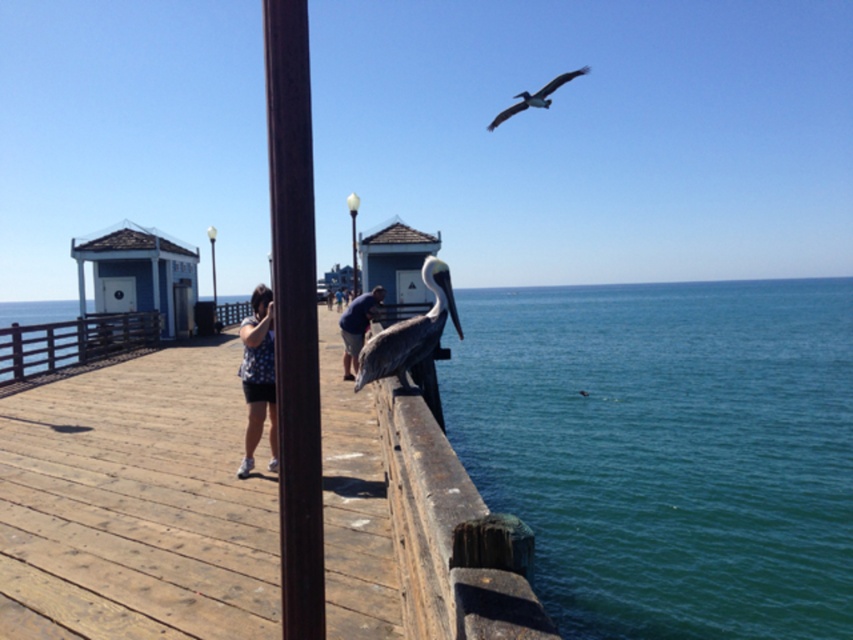
You are a photographer trying to capture the brown wood pole at center and the brown feathered pelican at upper right in the same frame. Based on their sizes, which object would appear smaller in the photo?

The brown wood pole at center appears smaller in the photo because it has a lesser width compared to the brown feathered pelican at upper right.

You are standing on the wooden pier and want to hang a small decorative flag between the brown wood pole at center and the white glossy lamp post at center. Which object should you attach the flag closer to if you want it to be at the same height as the pelican perched on the railing?

The brown wood pole at center is shorter than the white glossy lamp post at center, so attaching the flag closer to the brown wood pole at center would place it at the same height as the pelican.

You are a photographer trying to capture a photo of the brown feathered pelican at upper right and the dark blue shirt at center. Which object is wider in the image?

The dark blue shirt at center has a lesser width compared to brown feathered pelican at upper right, so the brown feathered pelican at upper right is wider in the image.